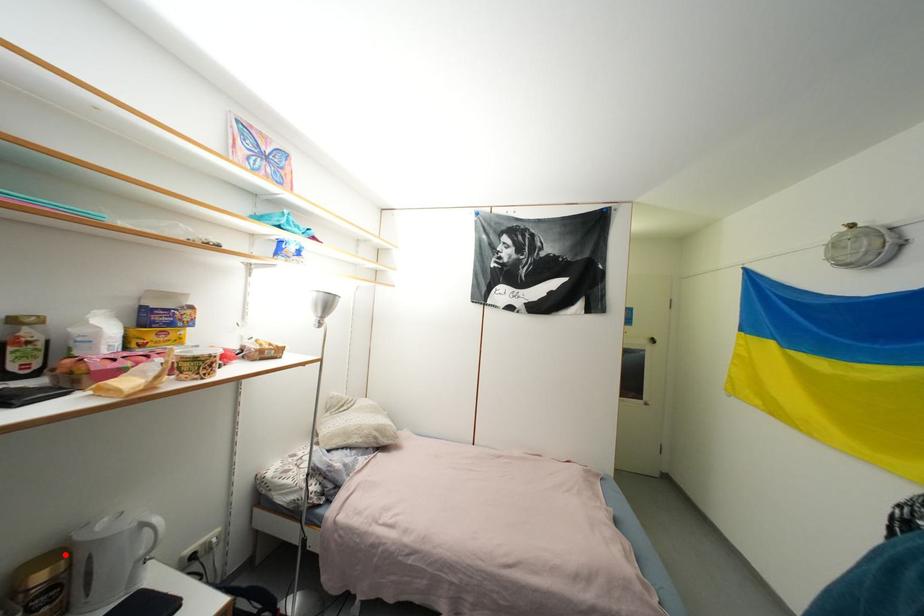
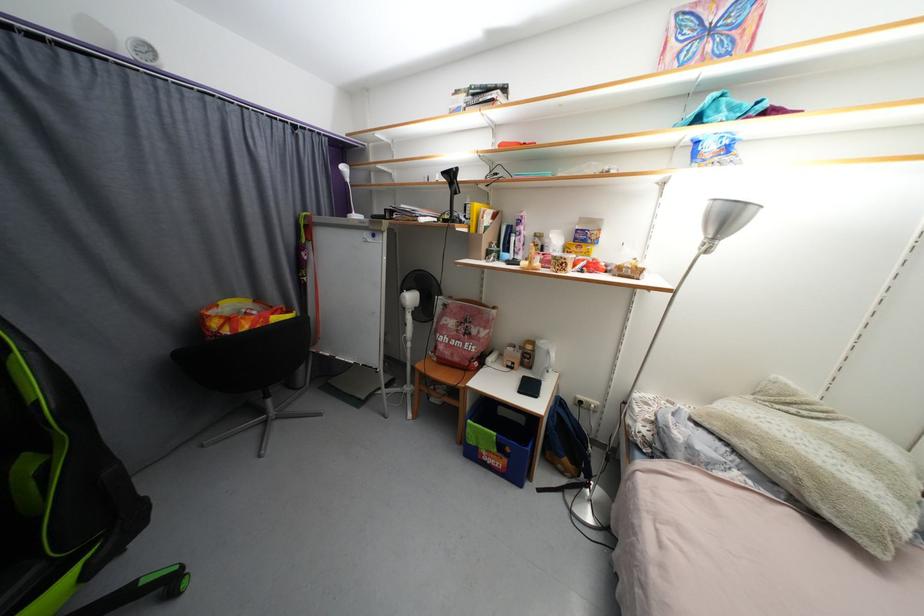
In the second image, find the point that corresponds to the highlighted location in the first image.

(538, 344)